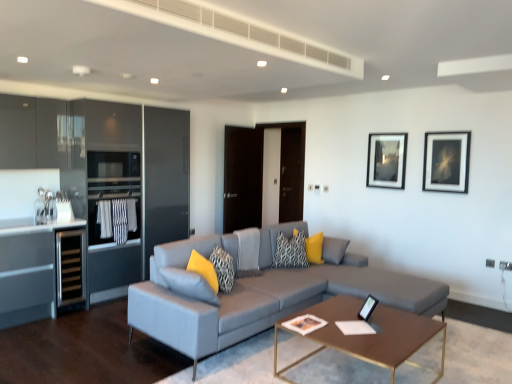
The height and width of the screenshot is (384, 512). Identify the location of free point above brown metallic coffee table at center (from a real-world perspective). (366, 322).